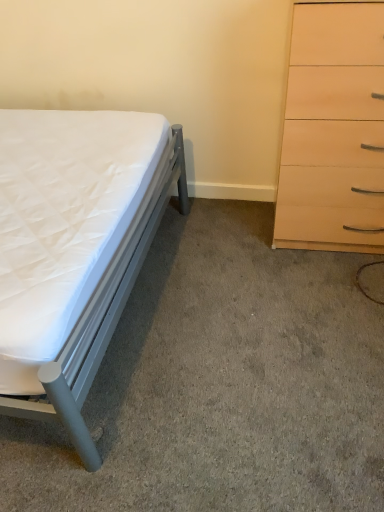
You are a GUI agent. You are given a task and a screenshot of the screen. Output one action in this format:
    pyautogui.click(x=<x>, y=<y>)
    Task: Click on the free location above white quilted mattress at lower left (from a real-world perspective)
    The width and height of the screenshot is (384, 512).
    Given the screenshot: What is the action you would take?
    228,366